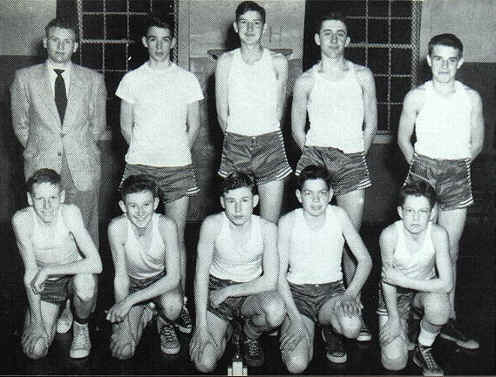
The width and height of the screenshot is (496, 377). What are the coordinates of `wall` in the screenshot? It's located at (443, 21).